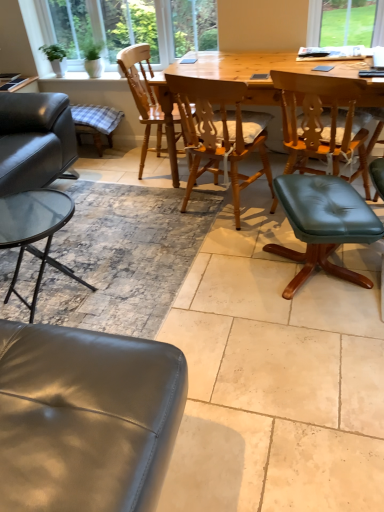
The width and height of the screenshot is (384, 512). I want to click on free space in front of teal leather stool at center-right, placed as the first bar stool when sorted from front to back, so click(x=317, y=335).